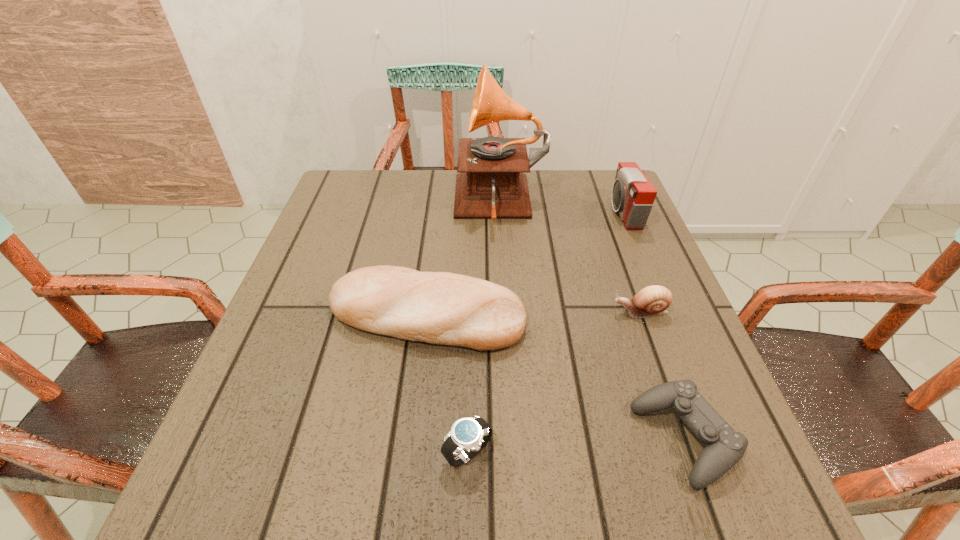
Image resolution: width=960 pixels, height=540 pixels. Find the location of `blank space at the left edge`. blank space at the left edge is located at coordinates pos(290,303).

Image resolution: width=960 pixels, height=540 pixels. In the image, there is a desktop. Find the location of `blank space at the right edge`. blank space at the right edge is located at coordinates (592, 248).

You are a GUI agent. You are given a task and a screenshot of the screen. Output one action in this format:
    pyautogui.click(x=<x>, y=<y>)
    Task: Click on the vacant area at the far left corner
    This screenshot has width=960, height=540.
    Given the screenshot: What is the action you would take?
    pyautogui.click(x=388, y=197)

Where is `vacant space at the near left corner`? Image resolution: width=960 pixels, height=540 pixels. vacant space at the near left corner is located at coordinates (256, 516).

Locate an element on the screen. vacant area that lies between the shortest object and the fifth shortest object is located at coordinates (654, 325).

The image size is (960, 540). I want to click on empty space that is in between the third tallest object and the watch, so click(x=447, y=384).

You are a GUI agent. You are given a task and a screenshot of the screen. Output one action in this format:
    pyautogui.click(x=<x>, y=<y>)
    Task: Click on the blank region between the watch and the escargot
    Image resolution: width=960 pixels, height=540 pixels.
    Given the screenshot: What is the action you would take?
    pyautogui.click(x=554, y=382)

Locate an element on the screen. The image size is (960, 540). empty space that is in between the camera and the watch is located at coordinates (545, 333).

You are a GUI agent. You are given a task and a screenshot of the screen. Output one action in this format:
    pyautogui.click(x=<x>, y=<y>)
    Task: Click on the empty space between the fifth shortest object and the escargot
    The width and height of the screenshot is (960, 540).
    Given the screenshot: What is the action you would take?
    pyautogui.click(x=632, y=262)

Identify the location of free spot between the tallest object and the shortest object. The height and width of the screenshot is (540, 960). pyautogui.click(x=592, y=322).